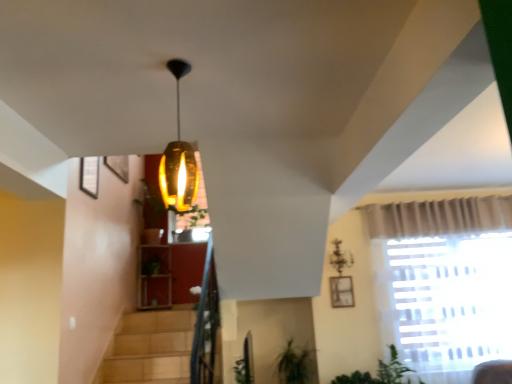
The image size is (512, 384). Find the location of `wooden frame at upper right`. wooden frame at upper right is located at coordinates (341, 291).

Describe the element at coordinates (341, 291) in the screenshot. This screenshot has height=384, width=512. I see `wooden frame at upper right` at that location.

Measure the distance between point (335,242) and camera.

The depth of point (335,242) is 4.94 meters.

This screenshot has height=384, width=512. What do you see at coordinates (340, 257) in the screenshot? I see `metallic chandelier at upper center` at bounding box center [340, 257].

Identify the location of metallic chandelier at upper center. This screenshot has height=384, width=512. (340, 257).

Measure the distance between metallic chandelier at upper center and camera.

They are 15.93 feet apart.

Image resolution: width=512 pixels, height=384 pixels. What are the coordinates of `wooden frame at upper right` in the screenshot? It's located at (341, 291).

Which is more to the right, wooden frame at upper right or metallic chandelier at upper center?

wooden frame at upper right.

Between wooden frame at upper right and metallic chandelier at upper center, which one is positioned in front?

metallic chandelier at upper center.

Does point (352, 285) come behind point (343, 266)?

No, it is in front of (343, 266).

From the image's perspective, is wooden frame at upper right located beneath metallic chandelier at upper center?

Yes, from the image's perspective, wooden frame at upper right is beneath metallic chandelier at upper center.

From a real-world perspective, is wooden frame at upper right under metallic chandelier at upper center?

Indeed, from a real-world perspective, wooden frame at upper right is positioned beneath metallic chandelier at upper center.

Considering the relative sizes of wooden frame at upper right and metallic chandelier at upper center in the image provided, is wooden frame at upper right thinner than metallic chandelier at upper center?

Indeed, wooden frame at upper right has a lesser width compared to metallic chandelier at upper center.

Is wooden frame at upper right taller or shorter than metallic chandelier at upper center?

Considering their sizes, wooden frame at upper right has less height than metallic chandelier at upper center.

Who is bigger, wooden frame at upper right or metallic chandelier at upper center?

metallic chandelier at upper center is bigger.

Is metallic chandelier at upper center a part of wooden frame at upper right?

No, metallic chandelier at upper center is not inside wooden frame at upper right.

Is the surface of wooden frame at upper right in direct contact with metallic chandelier at upper center?

wooden frame at upper right is not next to metallic chandelier at upper center, and they're not touching.

Is wooden frame at upper right aimed at metallic chandelier at upper center?

No, wooden frame at upper right is not facing towards metallic chandelier at upper center.

How different are the orientations of wooden frame at upper right and metallic chandelier at upper center in degrees?

0.00706 degrees separate the facing orientations of wooden frame at upper right and metallic chandelier at upper center.

The height and width of the screenshot is (384, 512). Identify the location of picture frame that is below the metallic chandelier at upper center (from the image's perspective). (341, 291).

Is metallic chandelier at upper center to the right of wooden frame at upper right from the viewer's perspective?

In fact, metallic chandelier at upper center is to the left of wooden frame at upper right.

Which object is closer to the camera taking this photo, metallic chandelier at upper center or wooden frame at upper right?

metallic chandelier at upper center.

In the scene shown: Which is closer to the camera, [342,264] or [331,294]?

Point [342,264].

From the image's perspective, which is above, metallic chandelier at upper center or wooden frame at upper right?

metallic chandelier at upper center appears higher in the image.

From a real-world perspective, is metallic chandelier at upper center below wooden frame at upper right?

No, from a real-world perspective, metallic chandelier at upper center is not under wooden frame at upper right.

Considering the relative sizes of metallic chandelier at upper center and wooden frame at upper right in the image provided, is metallic chandelier at upper center thinner than wooden frame at upper right?

No.

Is metallic chandelier at upper center shorter than wooden frame at upper right?

No, metallic chandelier at upper center is not shorter than wooden frame at upper right.

Which of these two, metallic chandelier at upper center or wooden frame at upper right, is bigger?

With larger size is metallic chandelier at upper center.

Would you say metallic chandelier at upper center is outside wooden frame at upper right?

metallic chandelier at upper center lies outside wooden frame at upper right's area.

Would you say metallic chandelier at upper center is a long distance from wooden frame at upper right?

No, there isn't a large distance between metallic chandelier at upper center and wooden frame at upper right.

Based on the photo, is metallic chandelier at upper center turned away from wooden frame at upper right?

No, wooden frame at upper right is not at the back of metallic chandelier at upper center.

This screenshot has height=384, width=512. What are the coordinates of `lamp on the left of wooden frame at upper right` in the screenshot? It's located at (340, 257).

Find the location of a particular element. This screenshot has width=512, height=384. lamp in front of the wooden frame at upper right is located at coordinates (340, 257).

Find the location of `picture frame on the right of metallic chandelier at upper center`. picture frame on the right of metallic chandelier at upper center is located at coordinates (341, 291).